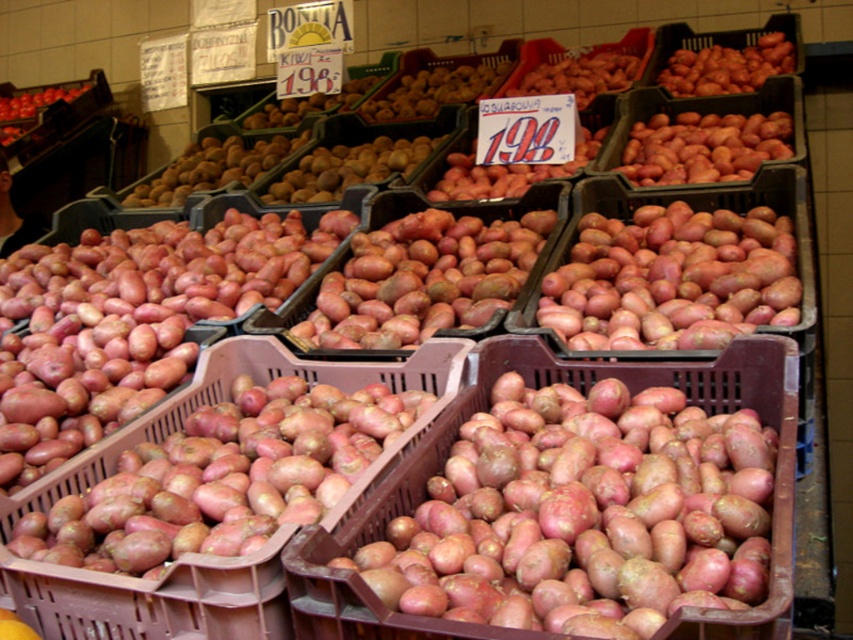
You are a customer at the market stall and want to choose between the smooth red potatoes at center and the matte red potato at center based on their width. Which one is wider?

The smooth red potatoes at center might be wider than matte red potato at center according to the description provided.

You are standing at the market stall and want to pick up both the matte red potato at center and the matte red potato at upper right. How far apart are these two potatoes from each other?

The matte red potato at center and the matte red potato at upper right are 9.13 feet apart from each other.

You are a customer at the market stall and want to buy the largest matte red potato available. You see both the matte red potato at center and the matte red potato at upper right. Which one should you choose?

The matte red potato at upper right is larger in size compared to the matte red potato at center, so you should choose the matte red potato at upper right.